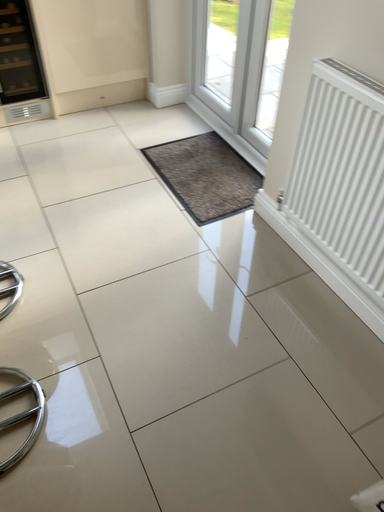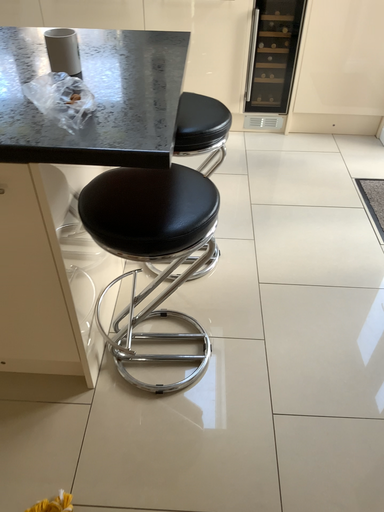
Question: How did the camera likely rotate when shooting the video?

Choices:
 (A) rotated right
 (B) rotated left

Answer: (B)